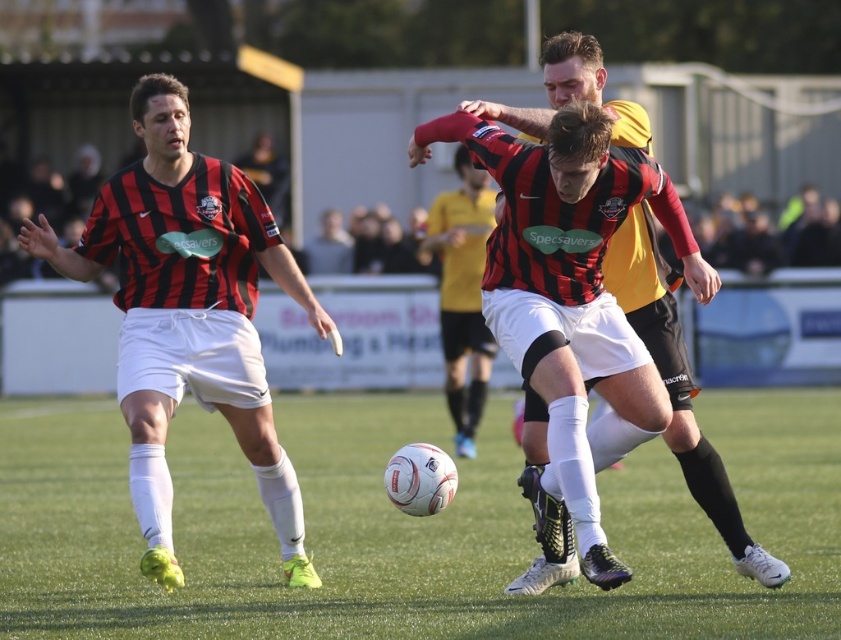
You are a soccer coach analyzing the play. You notice the matte black jersey at left and the matte black soccer ball at center. Which object is wider?

The matte black jersey at left is wider than the matte black soccer ball at center.